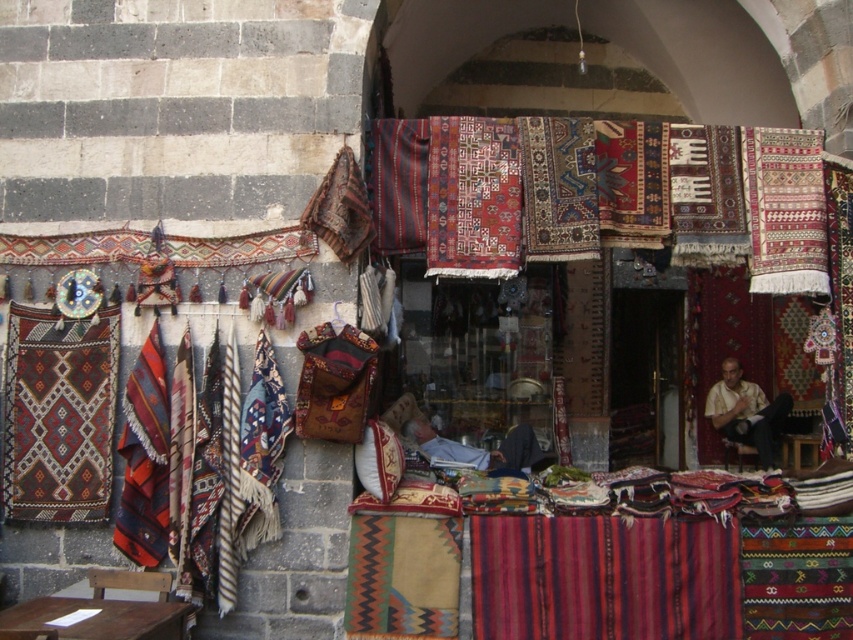
Question: Which point is farther to the camera?

Choices:
 (A) tap(383, 168)
 (B) tap(764, 419)
 (C) tap(427, 444)

Answer: (B)

Question: Considering the relative positions of dark brown woven rug at left and light brown woven shirt at center in the image provided, where is dark brown woven rug at left located with respect to light brown woven shirt at center?

Choices:
 (A) below
 (B) above

Answer: (B)

Question: Which point is farther from the camera taking this photo?

Choices:
 (A) (753, 257)
 (B) (772, 440)
 (C) (10, 500)

Answer: (B)

Question: Is multicolored woven rug at center behind striped wool rug at center?

Choices:
 (A) no
 (B) yes

Answer: (B)

Question: Can you confirm if dark brown woven rug at left is smaller than red woven rug at center?

Choices:
 (A) yes
 (B) no

Answer: (B)

Question: Which of the following is the farthest from the observer?

Choices:
 (A) dark blue fabric at center
 (B) red woven rug at center

Answer: (A)